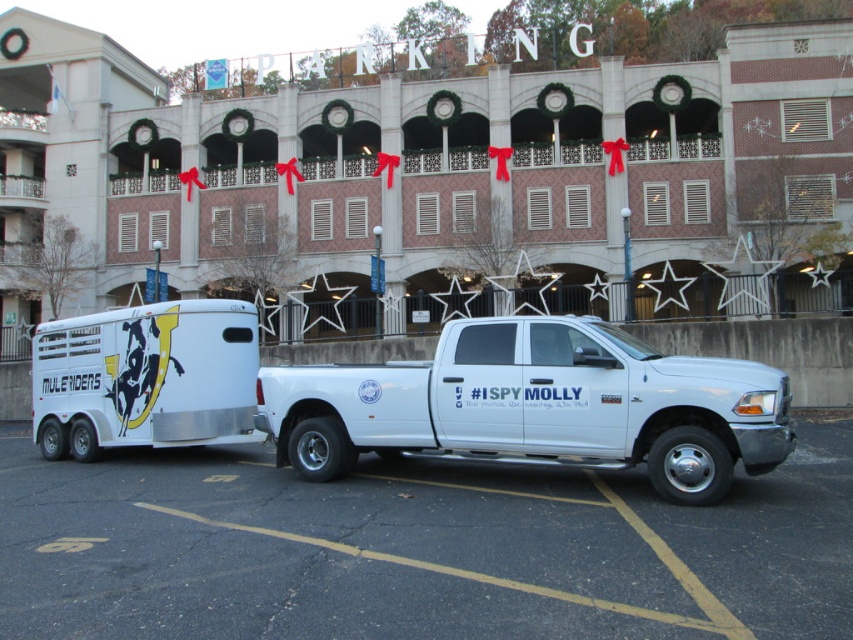
You are a delivery driver who needs to park your truck in a parking spot that requires the truck to fit entirely within the space. Given the scene, can you determine if the white matte truck at center can fit within the white smooth asphalt at lower center?

The white smooth asphalt at lower center is bigger than the white matte truck at center, so the truck can fit within the asphalt area.

You are a delivery driver who needs to park your vehicle in the parking lot. You see the white smooth asphalt at lower center and the metallic silver horse trailer at center. Which area has more space available for parking?

The metallic silver horse trailer at center occupies more space than the white smooth asphalt at lower center, so the area around the metallic silver horse trailer at center has more space available for parking.

You are standing at the point labeled point (416, 548) in the parking lot. What is the material under your feet?

The material under your feet at point (416, 548) is white smooth asphalt.